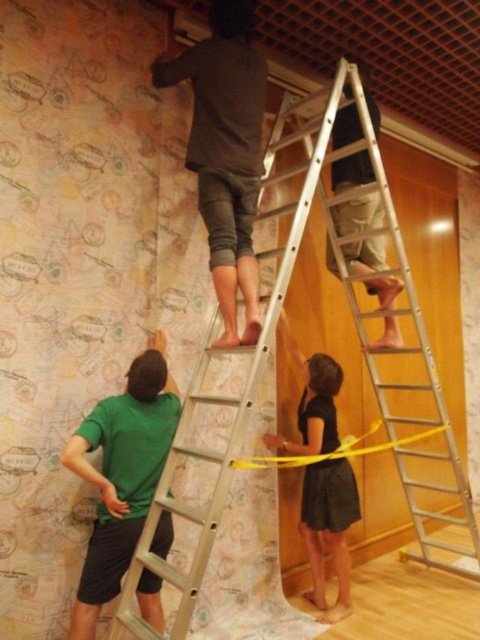
Is point (314, 394) positioned behind point (399, 442)?

No.

Locate an element on the screen. black matte dress at lower center is located at coordinates (328, 529).

Is point (312, 362) farther from viewer compared to point (312, 460)?

Yes, it is behind point (312, 460).

I want to click on black matte dress at lower center, so click(328, 529).

Is silver metallic ladder at center to the right of silver metallic ladder at upper center from the viewer's perspective?

No, silver metallic ladder at center is not to the right of silver metallic ladder at upper center.

Which is above, silver metallic ladder at center or silver metallic ladder at upper center?

silver metallic ladder at upper center is higher up.

Consider the image. Who is more forward, (398, 432) or (450, 440)?

Positioned in front is point (450, 440).

You are a GUI agent. You are given a task and a screenshot of the screen. Output one action in this format:
    pyautogui.click(x=<x>, y=<y>)
    Task: Click on the silver metallic ladder at center
    
    Given the screenshot: What is the action you would take?
    pyautogui.click(x=273, y=353)

From the picture: Which is more to the right, silver metallic ladder at upper center or yellow/yellowish plastic tape at lower center?

From the viewer's perspective, silver metallic ladder at upper center appears more on the right side.

Who is positioned more to the left, silver metallic ladder at upper center or yellow/yellowish plastic tape at lower center?

From the viewer's perspective, yellow/yellowish plastic tape at lower center appears more on the left side.

What do you see at coordinates (382, 312) in the screenshot? I see `silver metallic ladder at upper center` at bounding box center [382, 312].

The image size is (480, 640). I want to click on silver metallic ladder at upper center, so click(382, 312).